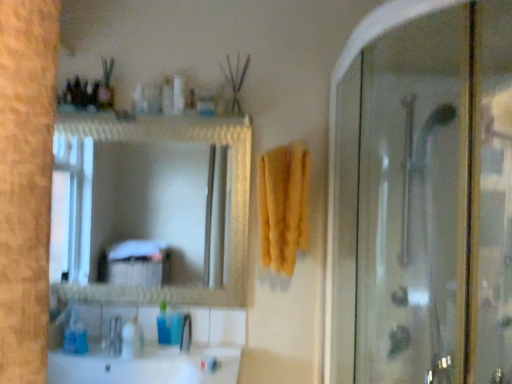
Measure the distance between blue plastic bottle at lower center, the third toiletry from the bottom, and camera.

They are 5.73 feet apart.

This screenshot has width=512, height=384. Find the location of `blue plastic bottle at lower center, the third toiletry when ordered from right to left`. blue plastic bottle at lower center, the third toiletry when ordered from right to left is located at coordinates (163, 325).

The width and height of the screenshot is (512, 384). What are the coordinates of `translucent plastic bottle at upper center, which is the 4th toiletry in bottom-to-top order` in the screenshot? It's located at (167, 96).

Describe the element at coordinates (167, 96) in the screenshot. I see `translucent plastic bottle at upper center, placed as the 1th toiletry when sorted from top to bottom` at that location.

Locate an element on the screen. This screenshot has height=384, width=512. blue plastic cup at lower center, which is counted as the first toiletry, starting from the right is located at coordinates (176, 326).

What do you see at coordinates (186, 334) in the screenshot?
I see `brushed metal faucet at lower center` at bounding box center [186, 334].

Where is `blue plastic bottle at lower center, which is the 2th toiletry from top to bottom`? The image size is (512, 384). blue plastic bottle at lower center, which is the 2th toiletry from top to bottom is located at coordinates (163, 325).

Is translucent plastic soap dispenser at lower left, placed as the second toiletry when sorted from bottom to top, inside the boundaries of white glossy sink at lower left, or outside?

translucent plastic soap dispenser at lower left, placed as the second toiletry when sorted from bottom to top, lies within the bounds of white glossy sink at lower left.

From the picture: Who is bigger, translucent plastic soap dispenser at lower left, marked as the 1th toiletry in a left-to-right arrangement, or white glossy sink at lower left?

white glossy sink at lower left is bigger.

Considering their positions, is translucent plastic soap dispenser at lower left, the 3th toiletry viewed from the top, located in front of or behind white glossy sink at lower left?

Visually, translucent plastic soap dispenser at lower left, the 3th toiletry viewed from the top, is located behind white glossy sink at lower left.

The width and height of the screenshot is (512, 384). There is a white glossy sink at lower left. Find the location of `the 2nd toiletry above it (from the image's perspective)`. the 2nd toiletry above it (from the image's perspective) is located at coordinates (132, 339).

I want to click on the 3rd toiletry to the left of the yellow soft towel at center, starting your count from the anchor, so click(163, 325).

Considering the relative sizes of blue plastic bottle at lower center, acting as the 2th toiletry starting from the left, and yellow soft towel at center in the image provided, is blue plastic bottle at lower center, acting as the 2th toiletry starting from the left, smaller than yellow soft towel at center?

Indeed, blue plastic bottle at lower center, acting as the 2th toiletry starting from the left, has a smaller size compared to yellow soft towel at center.

Consider the image. Choose the correct answer: Is yellow soft towel at center inside brushed metal faucet at lower center or outside it?

yellow soft towel at center is not enclosed by brushed metal faucet at lower center.

Are yellow soft towel at center and brushed metal faucet at lower center beside each other?

No.

Is point (285, 192) positioned before point (190, 322)?

Yes, point (285, 192) is in front of point (190, 322).

Considering the relative sizes of yellow soft towel at center and brushed metal faucet at lower center in the image provided, is yellow soft towel at center smaller than brushed metal faucet at lower center?

Actually, yellow soft towel at center might be larger than brushed metal faucet at lower center.

Does translucent plastic soap dispenser at lower left, which ranks as the 4th toiletry in right-to-left order, have a larger size compared to blue plastic bottle at lower center, which is the 2th toiletry from top to bottom?

Correct, translucent plastic soap dispenser at lower left, which ranks as the 4th toiletry in right-to-left order, is larger in size than blue plastic bottle at lower center, which is the 2th toiletry from top to bottom.

From the image's perspective, which one is positioned higher, translucent plastic soap dispenser at lower left, the 3th toiletry viewed from the top, or blue plastic bottle at lower center, acting as the 2th toiletry starting from the left?

blue plastic bottle at lower center, acting as the 2th toiletry starting from the left.

Is translucent plastic soap dispenser at lower left, the 3th toiletry viewed from the top, wider or thinner than blue plastic bottle at lower center, which is the 2th toiletry from top to bottom?

In the image, translucent plastic soap dispenser at lower left, the 3th toiletry viewed from the top, appears to be wider than blue plastic bottle at lower center, which is the 2th toiletry from top to bottom.

Is translucent plastic soap dispenser at lower left, which ranks as the 4th toiletry in right-to-left order, far from blue plastic bottle at lower center, the third toiletry from the bottom?

Actually, translucent plastic soap dispenser at lower left, which ranks as the 4th toiletry in right-to-left order, and blue plastic bottle at lower center, the third toiletry from the bottom, are a little close together.

Based on their positions, is brushed metal faucet at lower center located to the left or right of yellow soft towel at center?

brushed metal faucet at lower center is positioned on yellow soft towel at center's left side.

From the image's perspective, would you say brushed metal faucet at lower center is positioned over yellow soft towel at center?

No.

Is the depth of brushed metal faucet at lower center less than that of yellow soft towel at center?

No, it is behind yellow soft towel at center.

Locate an element on the screen. The height and width of the screenshot is (384, 512). bath towel above the brushed metal faucet at lower center (from a real-world perspective) is located at coordinates (283, 205).

Which is farther, (x=167, y=112) or (x=162, y=307)?

The point (x=162, y=307) is farther from the camera.

Which of these two, translucent plastic bottle at upper center, placed as the 1th toiletry when sorted from top to bottom, or blue plastic bottle at lower center, the third toiletry from the bottom, is bigger?

blue plastic bottle at lower center, the third toiletry from the bottom, is bigger.

Could you tell me if translucent plastic bottle at upper center, the 3th toiletry when ordered from left to right, is facing blue plastic bottle at lower center, the third toiletry when ordered from right to left?

No, translucent plastic bottle at upper center, the 3th toiletry when ordered from left to right, is not turned towards blue plastic bottle at lower center, the third toiletry when ordered from right to left.

Considering the sizes of translucent plastic soap dispenser at lower left, marked as the 1th toiletry in a left-to-right arrangement, and blue plastic cup at lower center, which is counted as the first toiletry, starting from the right, in the image, is translucent plastic soap dispenser at lower left, marked as the 1th toiletry in a left-to-right arrangement, taller or shorter than blue plastic cup at lower center, which is counted as the first toiletry, starting from the right,?

translucent plastic soap dispenser at lower left, marked as the 1th toiletry in a left-to-right arrangement, is taller than blue plastic cup at lower center, which is counted as the first toiletry, starting from the right.

Is translucent plastic soap dispenser at lower left, the 3th toiletry viewed from the top, looking in the opposite direction of blue plastic cup at lower center, which is the 4th toiletry from left to right?

That's not correct — translucent plastic soap dispenser at lower left, the 3th toiletry viewed from the top, is not looking away from blue plastic cup at lower center, which is the 4th toiletry from left to right.

Considering the relative positions of translucent plastic soap dispenser at lower left, placed as the second toiletry when sorted from bottom to top, and blue plastic cup at lower center, marked as the first toiletry in a bottom-to-top arrangement, in the image provided, is translucent plastic soap dispenser at lower left, placed as the second toiletry when sorted from bottom to top, in front of blue plastic cup at lower center, marked as the first toiletry in a bottom-to-top arrangement,?

That is True.

You are a GUI agent. You are given a task and a screenshot of the screen. Output one action in this format:
    pyautogui.click(x=<x>, y=<y>)
    Task: Click on the 1st toiletry behind the white glossy sink at lower left
    This screenshot has width=512, height=384.
    Given the screenshot: What is the action you would take?
    pyautogui.click(x=132, y=339)

At what (x,y) coordinates should I click in order to perform the action: click on bath towel that is in front of the blue plastic bottle at lower center, acting as the 2th toiletry starting from the left. Please return your answer as a coordinate pair (x, y). The image size is (512, 384). Looking at the image, I should click on (283, 205).

Looking at the image, which one is located closer to brushed metal faucet at lower center, translucent plastic soap dispenser at lower left, placed as the second toiletry when sorted from bottom to top, or yellow soft towel at center?

translucent plastic soap dispenser at lower left, placed as the second toiletry when sorted from bottom to top, is positioned closer to the anchor brushed metal faucet at lower center.

When comparing their distances from translucent plastic soap dispenser at lower left, marked as the 1th toiletry in a left-to-right arrangement, does yellow soft towel at center or white glossy sink at lower left seem further?

yellow soft towel at center is further to translucent plastic soap dispenser at lower left, marked as the 1th toiletry in a left-to-right arrangement.

Considering their positions, is blue plastic cup at lower center, marked as the first toiletry in a bottom-to-top arrangement, positioned closer to white glossy sink at lower left than blue plastic bottle at lower center, the third toiletry when ordered from right to left?

Among the two, blue plastic bottle at lower center, the third toiletry when ordered from right to left, is located nearer to white glossy sink at lower left.

Estimate the real-world distances between objects in this image. Which object is further from blue plastic cup at lower center, which is counted as the first toiletry, starting from the right, yellow soft towel at center or transparent glass shower door at right?

The object further to blue plastic cup at lower center, which is counted as the first toiletry, starting from the right, is transparent glass shower door at right.

Based on their spatial positions, is brushed metal faucet at lower center or yellow soft towel at center closer to translucent plastic soap dispenser at lower left, the 3th toiletry viewed from the top?

brushed metal faucet at lower center is closer to translucent plastic soap dispenser at lower left, the 3th toiletry viewed from the top.

Estimate the real-world distances between objects in this image. Which object is closer to translucent plastic soap dispenser at lower left, marked as the 1th toiletry in a left-to-right arrangement, blue plastic cup at lower center, which is the 4th toiletry from left to right, or translucent plastic bottle at upper center, the 3th toiletry when ordered from left to right?

blue plastic cup at lower center, which is the 4th toiletry from left to right, is closer to translucent plastic soap dispenser at lower left, marked as the 1th toiletry in a left-to-right arrangement.

Looking at the image, which one is located further to translucent plastic soap dispenser at lower left, the 3th toiletry viewed from the top, translucent plastic bottle at upper center, the 3th toiletry when ordered from left to right, or brushed metal faucet at lower center?

translucent plastic bottle at upper center, the 3th toiletry when ordered from left to right, is positioned further to the anchor translucent plastic soap dispenser at lower left, the 3th toiletry viewed from the top.

Based on their spatial positions, is translucent plastic soap dispenser at lower left, placed as the second toiletry when sorted from bottom to top, or transparent glass shower door at right further from white glossy sink at lower left?

transparent glass shower door at right lies further to white glossy sink at lower left than the other object.

The width and height of the screenshot is (512, 384). What are the coordinates of `bath towel between translucent plastic bottle at upper center, which is the 4th toiletry in bottom-to-top order, and blue plastic bottle at lower center, acting as the 2th toiletry starting from the left, in the vertical direction` in the screenshot? It's located at (283, 205).

Image resolution: width=512 pixels, height=384 pixels. In order to click on faucet between transparent glass shower door at right and translucent plastic bottle at upper center, the 3th toiletry when ordered from left to right, in the front-back direction in this screenshot , I will do `click(186, 334)`.

Locate an element on the screen. The height and width of the screenshot is (384, 512). faucet that lies between translucent plastic bottle at upper center, placed as the 1th toiletry when sorted from top to bottom, and white glossy sink at lower left from top to bottom is located at coordinates (186, 334).

Find the location of a particular element. The width and height of the screenshot is (512, 384). bath towel between translucent plastic bottle at upper center, placed as the 1th toiletry when sorted from top to bottom, and translucent plastic soap dispenser at lower left, marked as the 1th toiletry in a left-to-right arrangement, vertically is located at coordinates (283, 205).